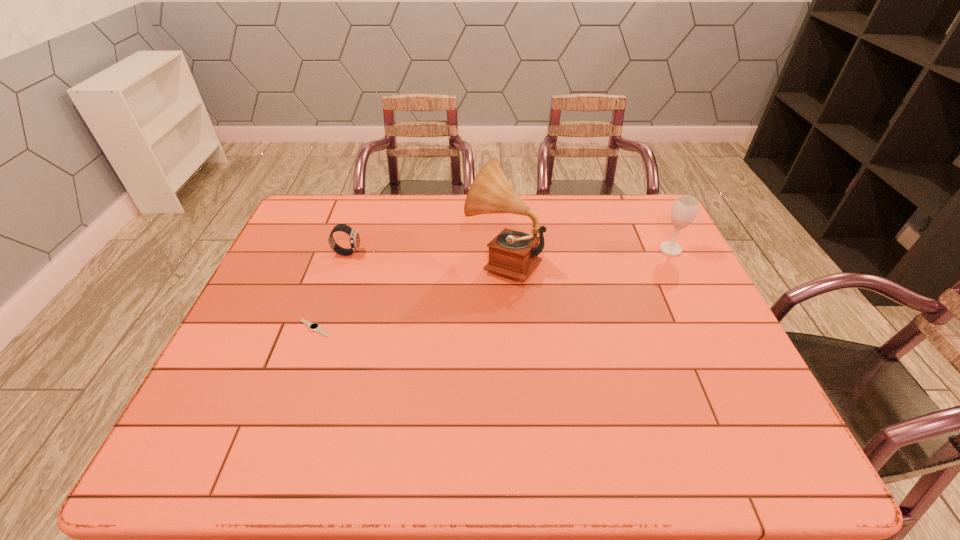
Find the location of a particular element. The image size is (960, 540). vacant space located on the horn of the tallest object is located at coordinates (376, 260).

The image size is (960, 540). I want to click on free location located on the left of the rightmost object, so click(601, 249).

You are a GUI agent. You are given a task and a screenshot of the screen. Output one action in this format:
    pyautogui.click(x=<x>, y=<y>)
    Task: Click on the vacant space located 0.210m on the face of the taller watch
    
    Given the screenshot: What is the action you would take?
    pyautogui.click(x=429, y=253)

Locate an element on the screen. blank area located 0.200m on the back of the shortest object is located at coordinates (336, 268).

You are a GUI agent. You are given a task and a screenshot of the screen. Output one action in this format:
    pyautogui.click(x=<x>, y=<y>)
    Task: Click on the object located at the far edge
    The image size is (960, 540).
    Given the screenshot: What is the action you would take?
    pyautogui.click(x=514, y=254)

The width and height of the screenshot is (960, 540). What are the coordinates of `object located in the left edge section of the desktop` in the screenshot? It's located at (313, 326).

You are a GUI agent. You are given a task and a screenshot of the screen. Output one action in this format:
    pyautogui.click(x=<x>, y=<y>)
    Task: Click on the object that is positioned at the right edge
    Image resolution: width=960 pixels, height=540 pixels.
    Given the screenshot: What is the action you would take?
    pyautogui.click(x=685, y=208)

Where is `free space at the far edge of the desktop`? free space at the far edge of the desktop is located at coordinates (524, 230).

This screenshot has width=960, height=540. In order to click on free space at the near edge in this screenshot , I will do `click(481, 467)`.

Locate an element on the screen. This screenshot has width=960, height=540. vacant region at the left edge of the desktop is located at coordinates (304, 292).